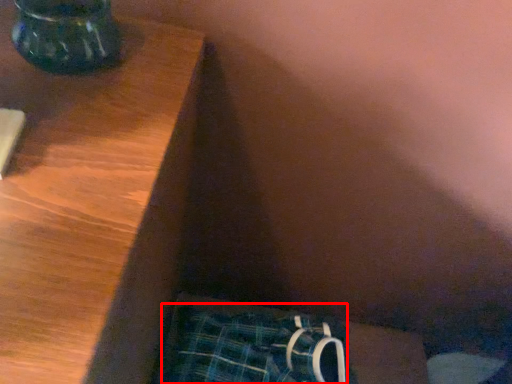
Question: From the image's perspective, what is the correct spatial relationship of underclothes (annotated by the red box) in relation to vase?

Choices:
 (A) above
 (B) below

Answer: (B)